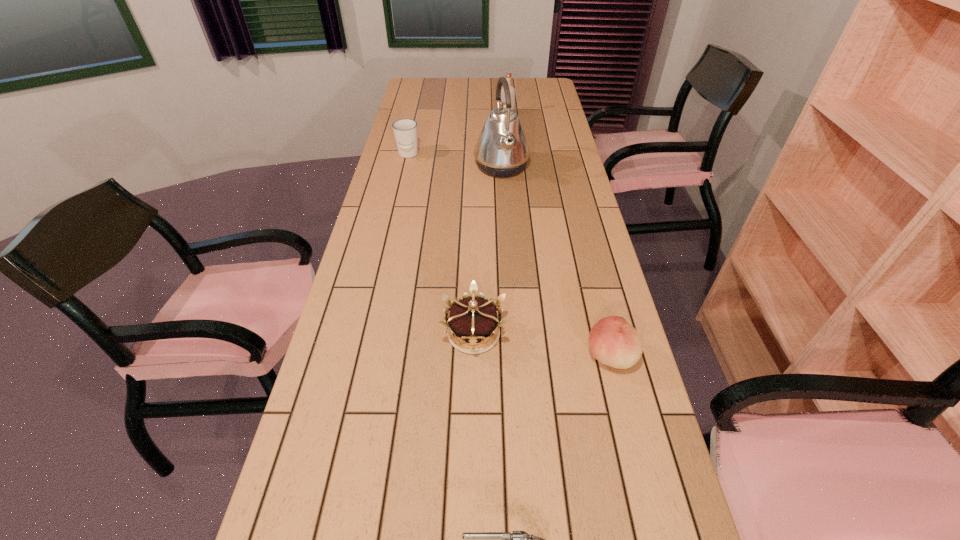
Find the location of a particular element. Image resolution: width=960 pixels, height=540 pixels. vacant area that satisfies the following two spatial constraints: 1. with a handle on the side of the tallest object; 2. on the left side of the cup is located at coordinates (405, 167).

The width and height of the screenshot is (960, 540). I want to click on free spot that satisfies the following two spatial constraints: 1. with a handle on the side of the cup; 2. on the right side of the peach, so tap(363, 356).

At what (x,y) coordinates should I click in order to perform the action: click on vacant space that satisfies the following two spatial constraints: 1. on the front side of the crown; 2. on the right side of the rightmost object. Please return your answer as a coordinate pair (x, y). Image resolution: width=960 pixels, height=540 pixels. Looking at the image, I should click on pyautogui.click(x=473, y=356).

This screenshot has width=960, height=540. I want to click on vacant area that satisfies the following two spatial constraints: 1. on the label of the farthest object; 2. with a handle on the side of the cup, so click(x=511, y=155).